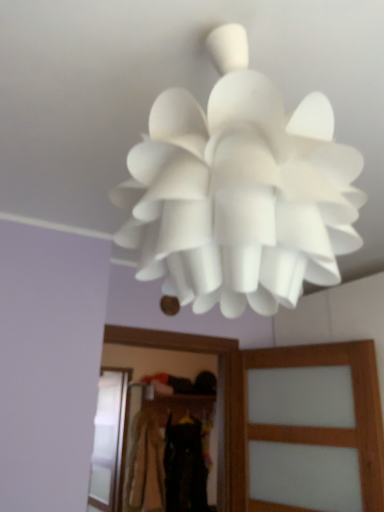
Question: Should I look upward or downward to see white matte lampshade at center?

Choices:
 (A) up
 (B) down

Answer: (A)

Question: From a real-world perspective, does dark brown fabric at center, acting as the 1th clothing starting from the front, stand above light brown fabric at center, which is the 3th clothing from front to back?

Choices:
 (A) yes
 (B) no

Answer: (A)

Question: Is dark brown fabric at center, acting as the 1th clothing starting from the front, at the right side of light brown fabric at center, arranged as the first clothing when viewed from the back?

Choices:
 (A) no
 (B) yes

Answer: (B)

Question: Is dark brown fabric at center, the third clothing in the back-to-front sequence, wider than light brown fabric at center, arranged as the first clothing when viewed from the back?

Choices:
 (A) no
 (B) yes

Answer: (B)

Question: Considering the relative sizes of dark brown fabric at center, acting as the 1th clothing starting from the front, and light brown fabric at center, which is the 3th clothing from front to back, in the image provided, is dark brown fabric at center, acting as the 1th clothing starting from the front, thinner than light brown fabric at center, which is the 3th clothing from front to back,?

Choices:
 (A) no
 (B) yes

Answer: (A)

Question: Can you confirm if dark brown fabric at center, the third clothing in the back-to-front sequence, is bigger than light brown fabric at center, arranged as the first clothing when viewed from the back?

Choices:
 (A) no
 (B) yes

Answer: (B)

Question: From the image's perspective, is dark brown fabric at center, acting as the 1th clothing starting from the front, located beneath light brown fabric at center, arranged as the first clothing when viewed from the back?

Choices:
 (A) yes
 (B) no

Answer: (B)

Question: Can you confirm if white matte lampshade at center is taller than black fabric at center, which appears as the second clothing when viewed from the back?

Choices:
 (A) yes
 (B) no

Answer: (B)

Question: Is the position of white matte lampshade at center more distant than that of black fabric at center, which is the second clothing from front to back?

Choices:
 (A) yes
 (B) no

Answer: (B)

Question: Does white matte lampshade at center appear on the right side of black fabric at center, which appears as the second clothing when viewed from the back?

Choices:
 (A) yes
 (B) no

Answer: (A)

Question: Are white matte lampshade at center and black fabric at center, which is the second clothing from front to back, beside each other?

Choices:
 (A) no
 (B) yes

Answer: (A)

Question: From a real-world perspective, is white matte lampshade at center physically below black fabric at center, which appears as the second clothing when viewed from the back?

Choices:
 (A) yes
 (B) no

Answer: (B)

Question: From a real-world perspective, is white matte lampshade at center over black fabric at center, which is the second clothing from front to back?

Choices:
 (A) no
 (B) yes

Answer: (B)

Question: Can you confirm if translucent wood screen door at center, which is the 2th screen door in left-to-right order, is bigger than dark brown fabric at center, the third clothing in the back-to-front sequence?

Choices:
 (A) no
 (B) yes

Answer: (A)